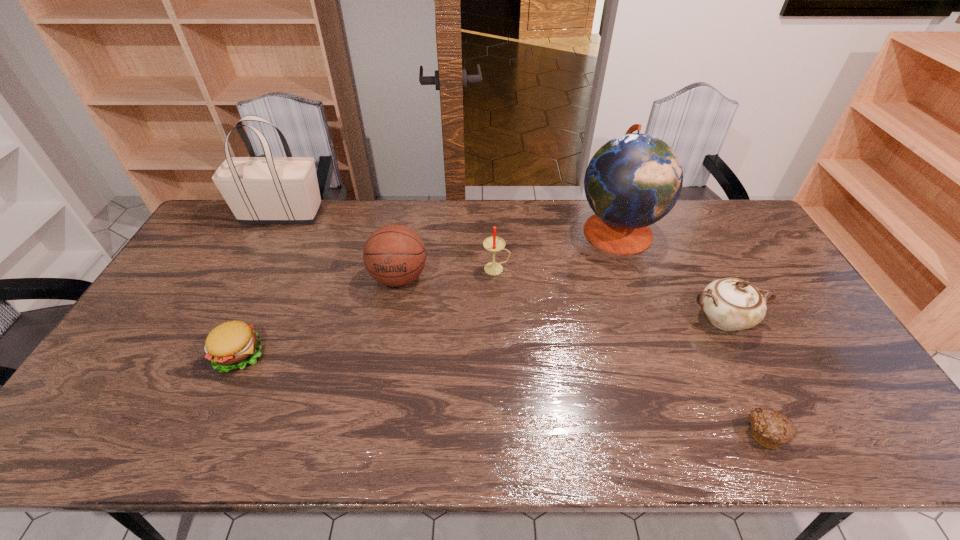
The image size is (960, 540). What are the coordinates of `free spot between the chinaware and the globe` in the screenshot? It's located at (670, 275).

Where is `unoccupied position between the basketball and the globe`? The image size is (960, 540). unoccupied position between the basketball and the globe is located at coordinates (508, 254).

Locate an element on the screen. vacant area that lies between the muffin and the chinaware is located at coordinates (744, 376).

Locate an element on the screen. Image resolution: width=960 pixels, height=540 pixels. vacant space that is in between the candle and the shortest object is located at coordinates (631, 351).

What are the coordinates of `free space between the hamburger and the fifth object from right to left` in the screenshot? It's located at (319, 316).

Locate an element on the screen. vacant area between the second shortest object and the globe is located at coordinates (428, 293).

Locate which object is the closest to the nearest object. Please provide its 2D coordinates. Your answer should be formatted as a tuple, i.e. [(x, y)], where the tuple contains the x and y coordinates of a point satisfying the conditions above.

[(731, 304)]

Point out which object is positioned as the fourth nearest to the shortest object. Please provide its 2D coordinates. Your answer should be formatted as a tuple, i.e. [(x, y)], where the tuple contains the x and y coordinates of a point satisfying the conditions above.

[(394, 255)]

The width and height of the screenshot is (960, 540). I want to click on vacant position in the image that satisfies the following two spatial constraints: 1. with the Americas facing the viewer on the globe; 2. on the back side of the muffin, so click(687, 433).

You are a GUI agent. You are given a task and a screenshot of the screen. Output one action in this format:
    pyautogui.click(x=<x>, y=<y>)
    Task: Click on the free space that satisfies the following two spatial constraints: 1. with the Americas facing the viewer on the chinaware; 2. on the left side of the globe
    The height and width of the screenshot is (540, 960).
    Given the screenshot: What is the action you would take?
    pyautogui.click(x=648, y=319)